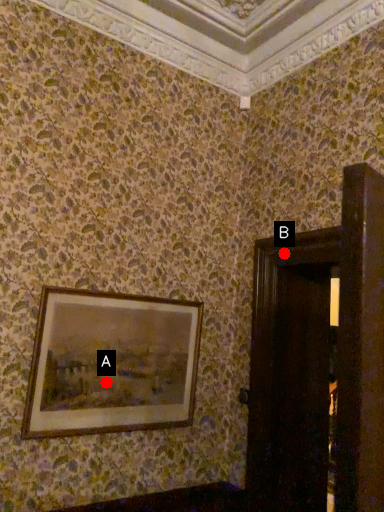
Question: Two points are circled on the image, labeled by A and B beside each circle. Which point is further to the camera?

Choices:
 (A) A is further
 (B) B is further

Answer: (B)